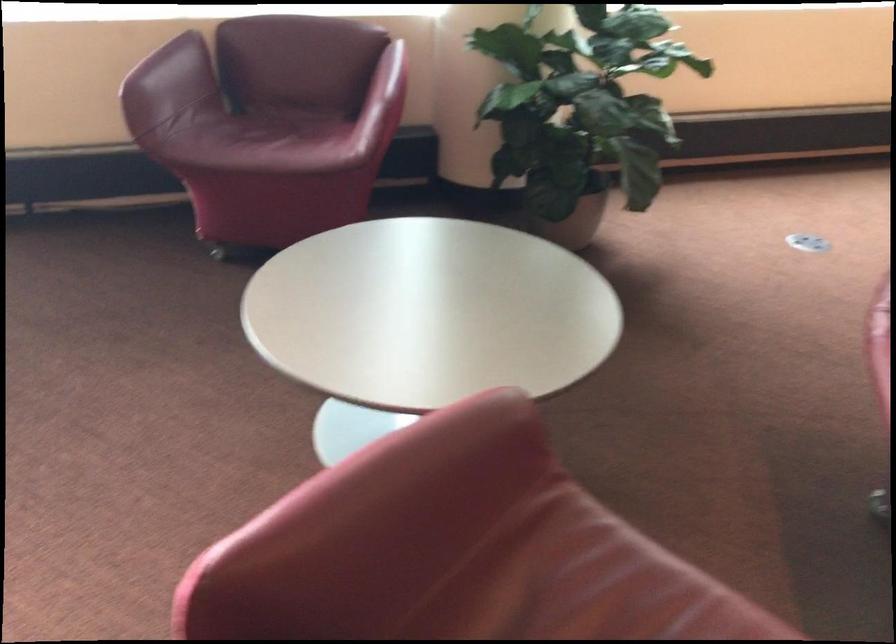
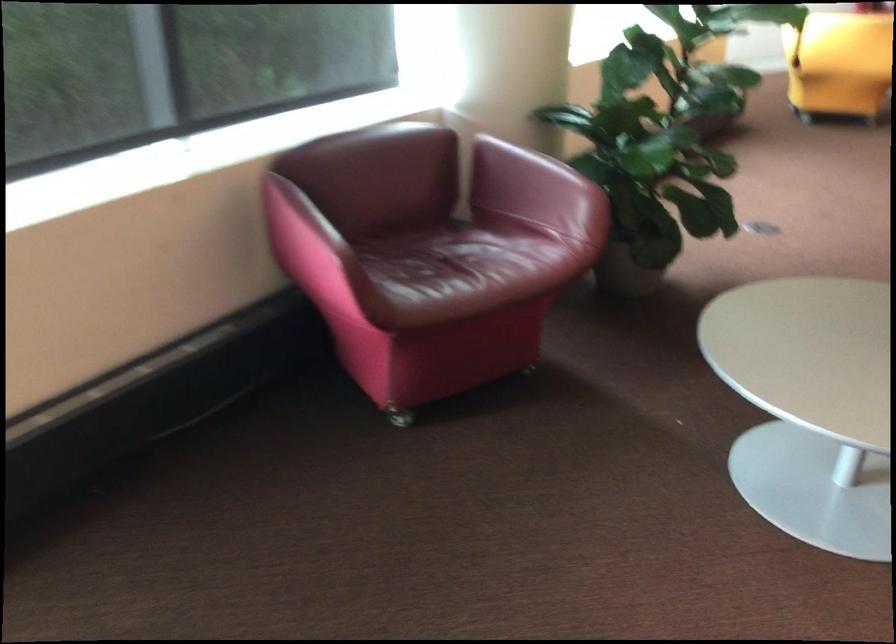
The point at (382, 77) is marked in the first image. Where is the corresponding point in the second image?

(543, 169)